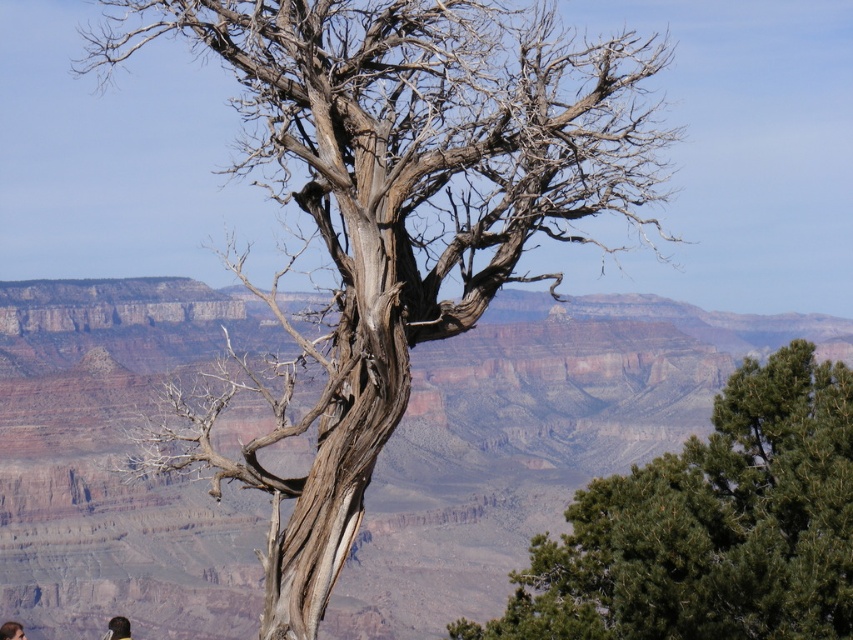
You are an artist planning to paint the landscape. You want to ensure the gray bark tree at center and the green textured pine tree at center are positioned accurately. Based on the scene, which tree should be placed higher in your painting?

The gray bark tree at center should be placed higher in the painting because it is positioned above the green textured pine tree at center in the image.

You are a photographer standing at the edge of the Grand Canyon. You want to take a photo of the gray bark tree at center. Where should you position yourself to ensure the tree is centered in your shot?

To center the gray bark tree at center in your photo, position yourself directly in line with its coordinates at point (401, 205).